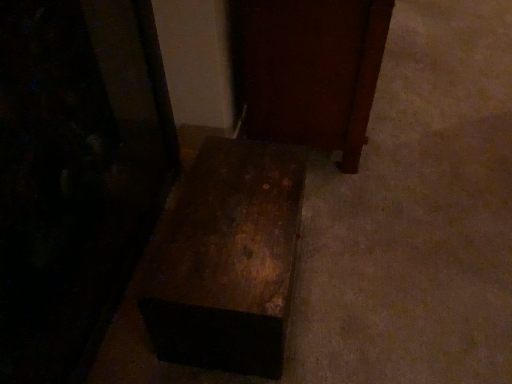
Question: From the image's perspective, relative to rusty metal box at lower center, the third furniture in the right-to-left sequence, is rusty wood trunk at center, arranged as the second furniture when viewed from the right, above or below?

Choices:
 (A) below
 (B) above

Answer: (A)

Question: In the image, is rusty wood trunk at center, placed as the second furniture when sorted from left to right, positioned in front of or behind rusty metal box at lower center, the 1th furniture from the left?

Choices:
 (A) front
 (B) behind

Answer: (B)

Question: Which is farther from the rusty wood trunk at center, placed as the second furniture when sorted from left to right?

Choices:
 (A) dark wood door at center, which appears as the 3th furniture when viewed from the left
 (B) rusty metal box at lower center, the 1th furniture from the left

Answer: (A)

Question: Considering the real-world distances, which object is farthest from the dark wood door at center, marked as the 1th furniture in a right-to-left arrangement?

Choices:
 (A) rusty metal box at lower center, the 1th furniture from the left
 (B) rusty wood trunk at center, arranged as the second furniture when viewed from the right

Answer: (A)